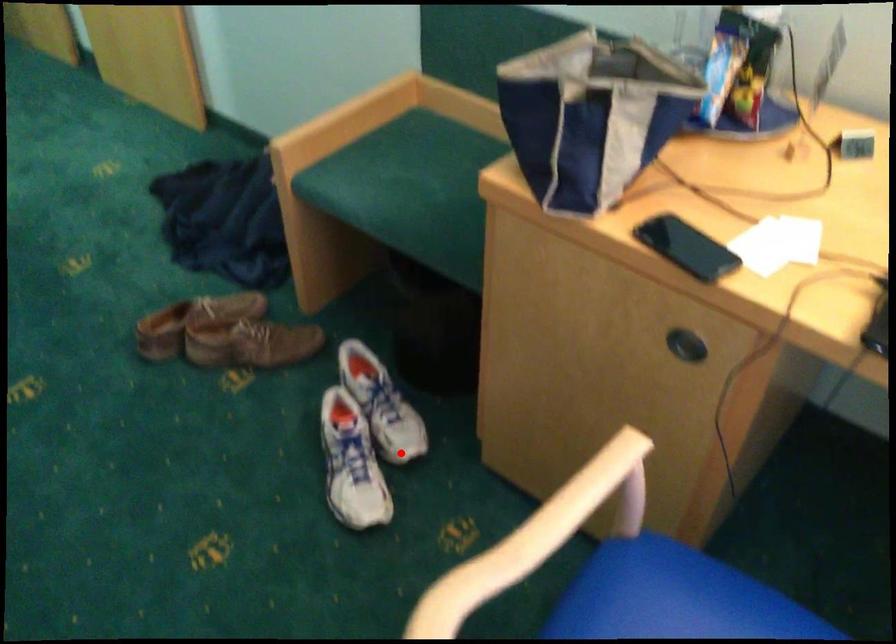
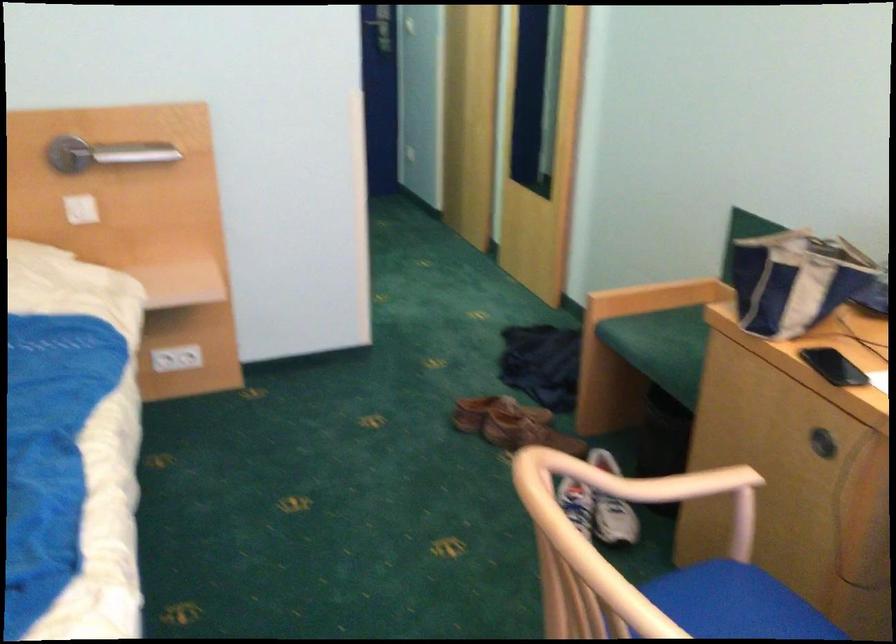
Question: I am providing you with two images of the same scene from different viewpoints. Image1 has a red point marked. In image2, the corresponding 3D location appears at what relative position? Reply with the corresponding letter.

Choices:
 (A) Closer
 (B) Farther

Answer: (B)